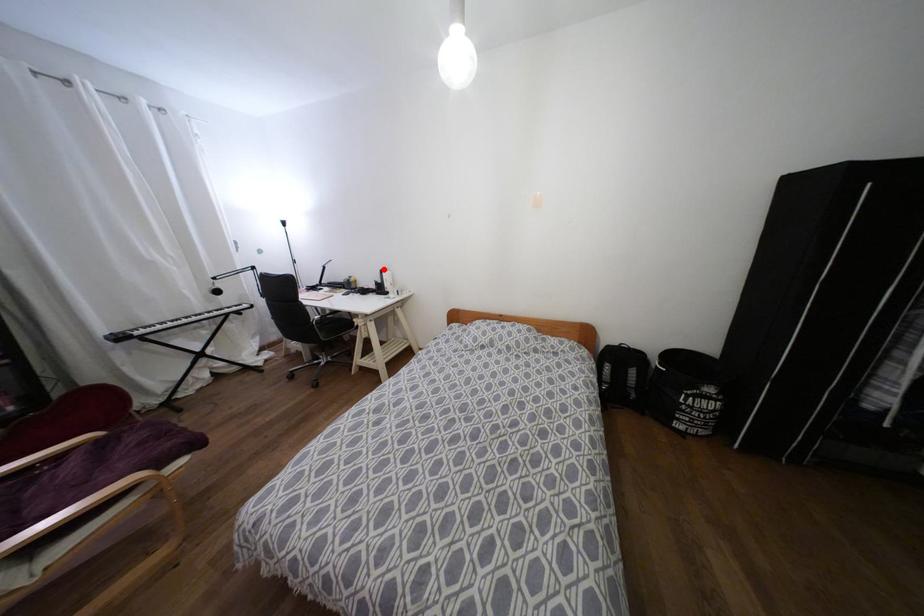
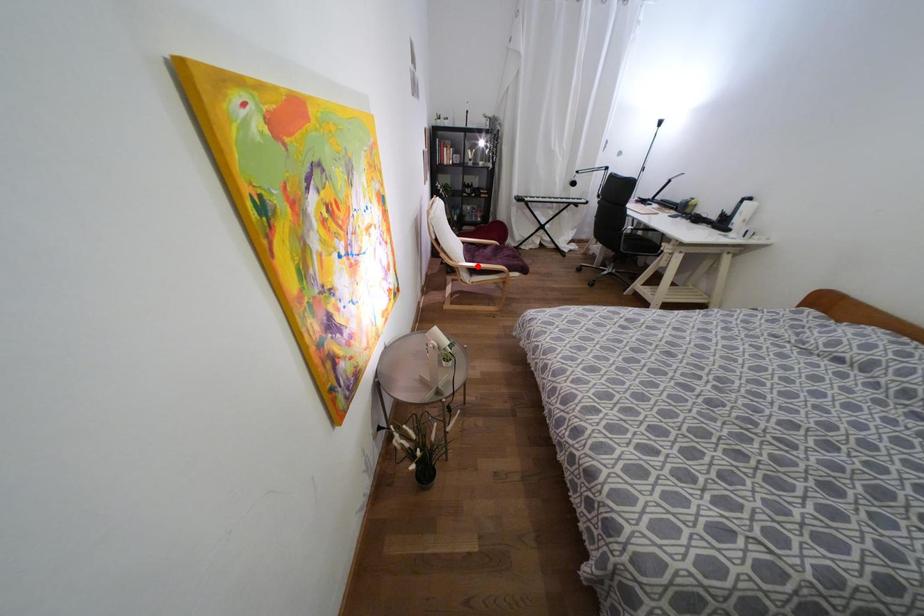
I am providing you with two images of the same scene from different viewpoints. A red point is marked on the first image and another point is marked on the second image. Is the marked point in image1 the same physical position as the marked point in image2?

No